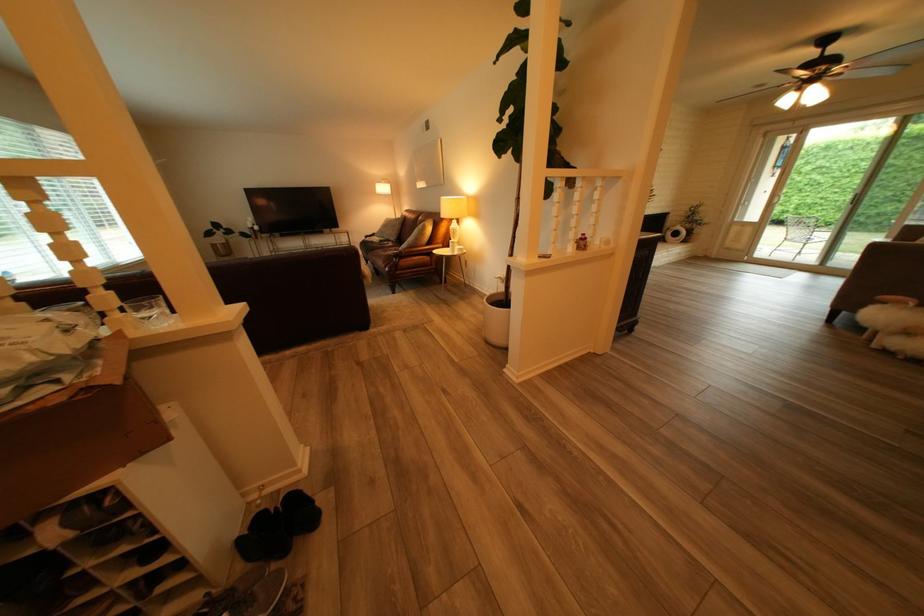
Identify the location of dark sofa sitting surface. (298, 299).